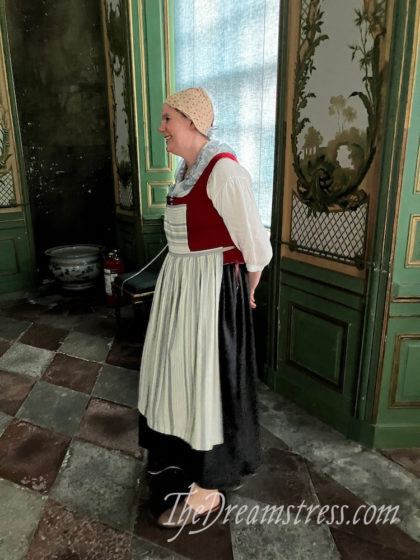
Find the location of a particular element. The width and height of the screenshot is (420, 560). fire extinguisher is located at coordinates (118, 268).